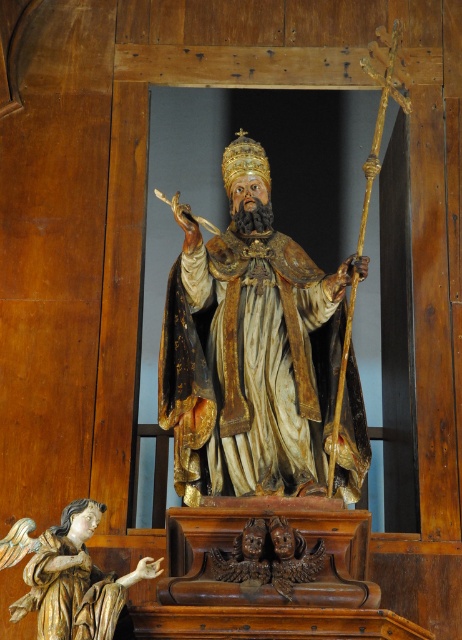
You are an interior designer planning to place a new decorative item between the wooden statue at center and the wooden angel at lower left. Based on their widths, which object should you consider moving to ensure enough space?

The wooden statue at center might be wider than the wooden angel at lower left, so you should consider moving the wooden statue at center to ensure enough space for the new decorative item.